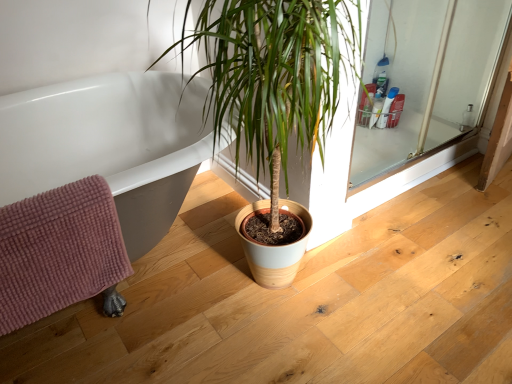
You are a GUI agent. You are given a task and a screenshot of the screen. Output one action in this format:
    pyautogui.click(x=<x>, y=<y>)
    Task: Click on the vacant space in clear glass screen door at upper right (from a real-world perspective)
    This screenshot has height=384, width=512.
    Given the screenshot: What is the action you would take?
    pyautogui.click(x=402, y=175)